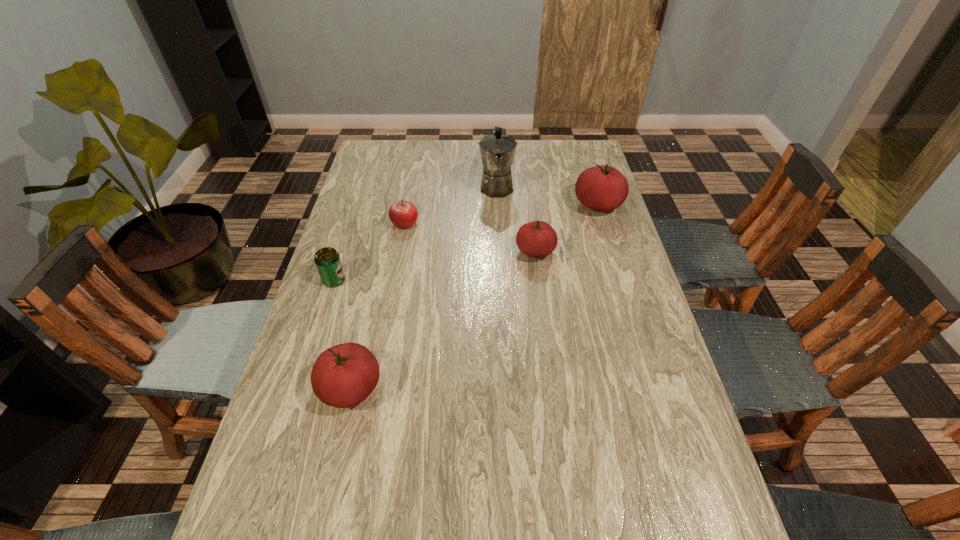
Where is `unoccupied position between the nearest tomato and the rightmost object`? The image size is (960, 540). unoccupied position between the nearest tomato and the rightmost object is located at coordinates (474, 297).

I want to click on free space between the rightmost tomato and the leftmost object, so click(466, 242).

Locate an element on the screen. This screenshot has height=540, width=960. vacant space in between the coffeepot and the shortest object is located at coordinates (450, 204).

You are a GUI agent. You are given a task and a screenshot of the screen. Output one action in this format:
    pyautogui.click(x=<x>, y=<y>)
    Task: Click on the vacant space that's between the second nearest tomato and the apple
    The width and height of the screenshot is (960, 540).
    Given the screenshot: What is the action you would take?
    tap(470, 237)

This screenshot has height=540, width=960. In order to click on vacant space that's between the second nearest object and the tallest object in this screenshot , I will do `click(416, 233)`.

Locate an element on the screen. The height and width of the screenshot is (540, 960). object that ranks as the second closest to the coffeepot is located at coordinates (602, 188).

Choose which object is the fifth nearest neighbor to the second nearest object. Please provide its 2D coordinates. Your answer should be formatted as a tuple, i.e. [(x, y)], where the tuple contains the x and y coordinates of a point satisfying the conditions above.

[(602, 188)]

Point out which tomato is positioned as the nearest to the farthest tomato. Please provide its 2D coordinates. Your answer should be formatted as a tuple, i.e. [(x, y)], where the tuple contains the x and y coordinates of a point satisfying the conditions above.

[(537, 239)]

Identify which tomato is located as the second nearest to the rightmost tomato. Please provide its 2D coordinates. Your answer should be formatted as a tuple, i.e. [(x, y)], where the tuple contains the x and y coordinates of a point satisfying the conditions above.

[(344, 375)]

This screenshot has height=540, width=960. Find the location of `free space that satisfies the following two spatial constraints: 1. on the back side of the second nearest tomato; 2. on the left side of the nearest object`. free space that satisfies the following two spatial constraints: 1. on the back side of the second nearest tomato; 2. on the left side of the nearest object is located at coordinates (382, 252).